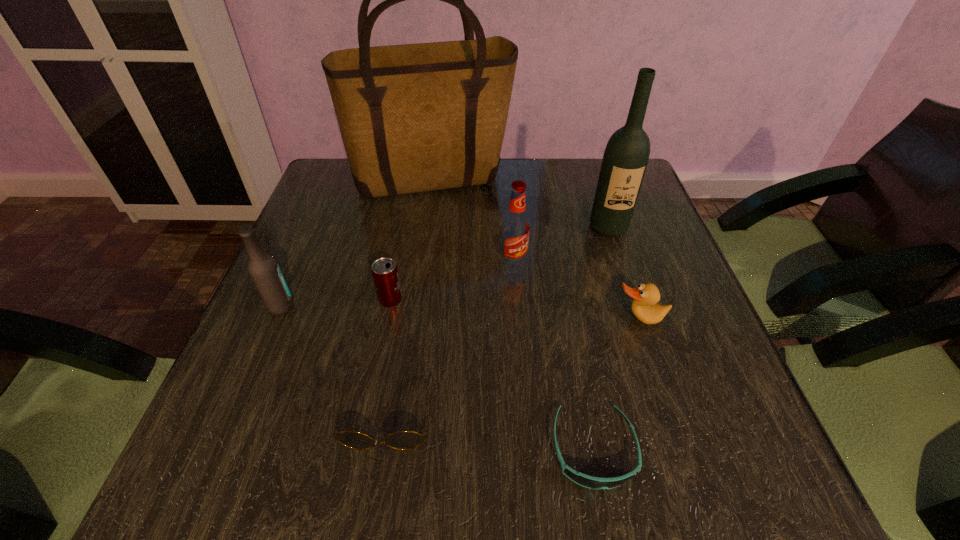
You are a GUI agent. You are given a task and a screenshot of the screen. Output one action in this format:
    pyautogui.click(x=<x>, y=<y>)
    Task: Click on the tallest object
    The image size is (960, 540).
    Given the screenshot: What is the action you would take?
    pyautogui.click(x=420, y=117)

Identify the location of the farthest object. (420, 117).

This screenshot has height=540, width=960. In order to click on the second farthest object in this screenshot , I will do `click(625, 159)`.

At what (x,y) coordinates should I click in order to perform the action: click on the second tallest object. Please return your answer as a coordinate pair (x, y). Image resolution: width=960 pixels, height=540 pixels. Looking at the image, I should click on (625, 159).

Find the location of a particular element. The image size is (960, 540). the sixth nearest object is located at coordinates (515, 229).

Locate an element on the screen. beer bottle is located at coordinates (263, 269).

Identify the location of beer can. This screenshot has height=540, width=960. (384, 270).

Image resolution: width=960 pixels, height=540 pixels. Find the location of `duck`. duck is located at coordinates (646, 296).

Identify the location of the second shortest object. (402, 440).

Where is `the left sunglasses`? The image size is (960, 540). the left sunglasses is located at coordinates (402, 440).